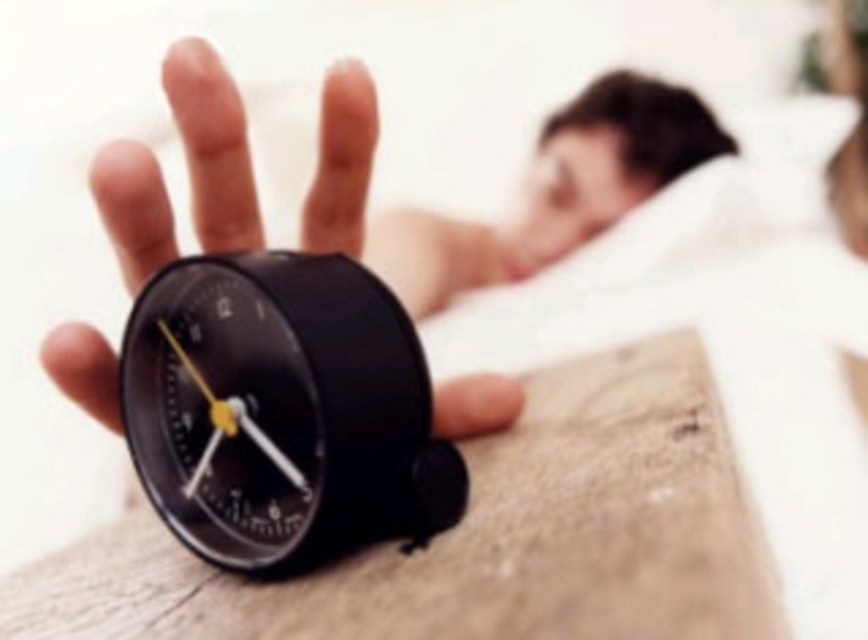
Can you confirm if black plastic alarm clock at center is positioned below matte black alarm clock at center?

Yes, black plastic alarm clock at center is below matte black alarm clock at center.

Is black plastic alarm clock at center to the right of matte black alarm clock at center from the viewer's perspective?

In fact, black plastic alarm clock at center is to the left of matte black alarm clock at center.

Is point (227, 273) less distant than point (229, 140)?

Yes, point (227, 273) is closer to viewer.

Image resolution: width=868 pixels, height=640 pixels. Identify the location of black plastic alarm clock at center. (281, 410).